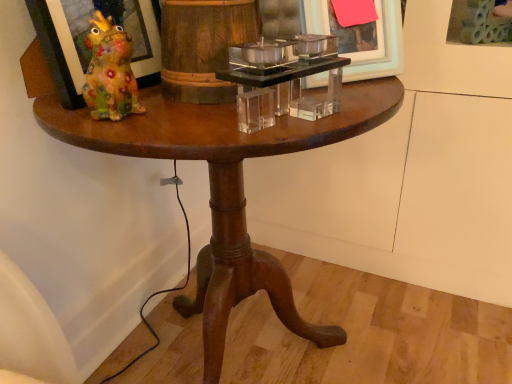
Question: In terms of height, does matte glass picture frame at left, which is the first picture frame in left-to-right order, look taller or shorter compared to clear acrylic candle holder at center?

Choices:
 (A) short
 (B) tall

Answer: (B)

Question: Is matte glass picture frame at left, which is the first picture frame in left-to-right order, situated inside clear acrylic candle holder at center or outside?

Choices:
 (A) outside
 (B) inside

Answer: (A)

Question: Based on their relative distances, which object is farther from the clear acrylic picture frame at upper right, the first picture frame when ordered from right to left?

Choices:
 (A) matte glass picture frame at left, which is the first picture frame in left-to-right order
 (B) matte white picture frame at upper center, marked as the 2th picture frame in a right-to-left arrangement
 (C) wooden pedestal table at center
 (D) clear acrylic candle holder at center

Answer: (A)

Question: Considering the real-world distances, which object is farthest from the wooden pedestal table at center?

Choices:
 (A) matte glass picture frame at left, which is the first picture frame in left-to-right order
 (B) clear acrylic picture frame at upper right, the first picture frame when ordered from right to left
 (C) clear acrylic candle holder at center
 (D) matte white picture frame at upper center, marked as the 2th picture frame in a right-to-left arrangement

Answer: (B)